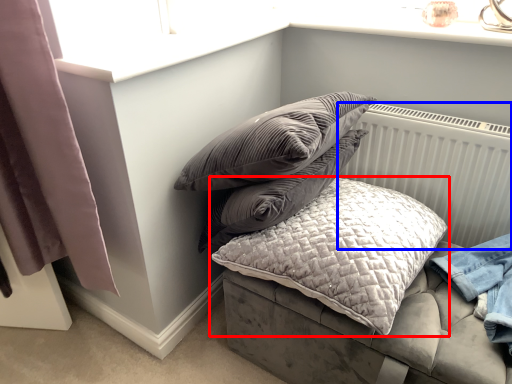
Question: Which object appears closest to the camera in this image, pillow (highlighted by a red box) or radiator (highlighted by a blue box)?

Choices:
 (A) pillow
 (B) radiator

Answer: (A)